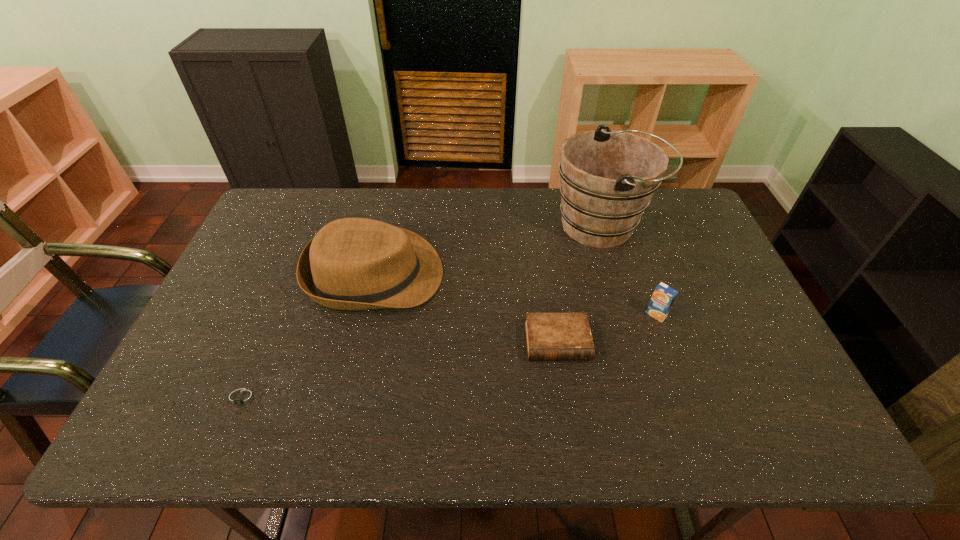
Where is `blank space located on the spine side of the fourth farthest object`? blank space located on the spine side of the fourth farthest object is located at coordinates (571, 439).

Where is `free space located on the face of the nearest object`? The height and width of the screenshot is (540, 960). free space located on the face of the nearest object is located at coordinates (228, 438).

The height and width of the screenshot is (540, 960). I want to click on object at the far edge, so click(608, 177).

Where is `object at the near edge`? object at the near edge is located at coordinates (242, 399).

You are a GUI agent. You are given a task and a screenshot of the screen. Output one action in this format:
    pyautogui.click(x=<x>, y=<y>)
    Task: Click on the object situated at the left edge
    
    Given the screenshot: What is the action you would take?
    pyautogui.click(x=242, y=399)

Identify the location of object that is at the right edge. This screenshot has width=960, height=540. (608, 177).

What are the coordinates of `object located in the near left corner section of the desktop` in the screenshot? It's located at (242, 399).

Identify the location of object that is at the far right corner. The width and height of the screenshot is (960, 540). (608, 177).

In the image, there is a desktop. Identify the location of free space at the far edge. The image size is (960, 540). (476, 198).

The height and width of the screenshot is (540, 960). I want to click on free space at the near edge of the desktop, so click(x=348, y=443).